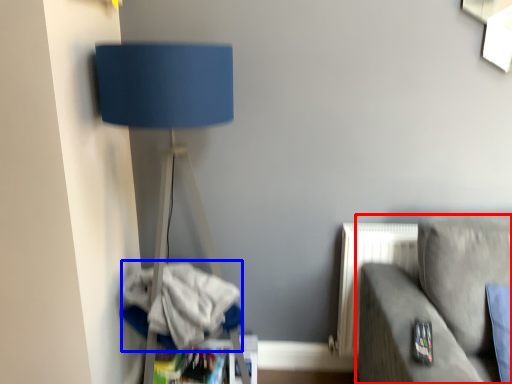
Question: Which point is closer to the camera, studio couch (highlighted by a red box) or laundry (highlighted by a blue box)?

Choices:
 (A) studio couch
 (B) laundry

Answer: (A)